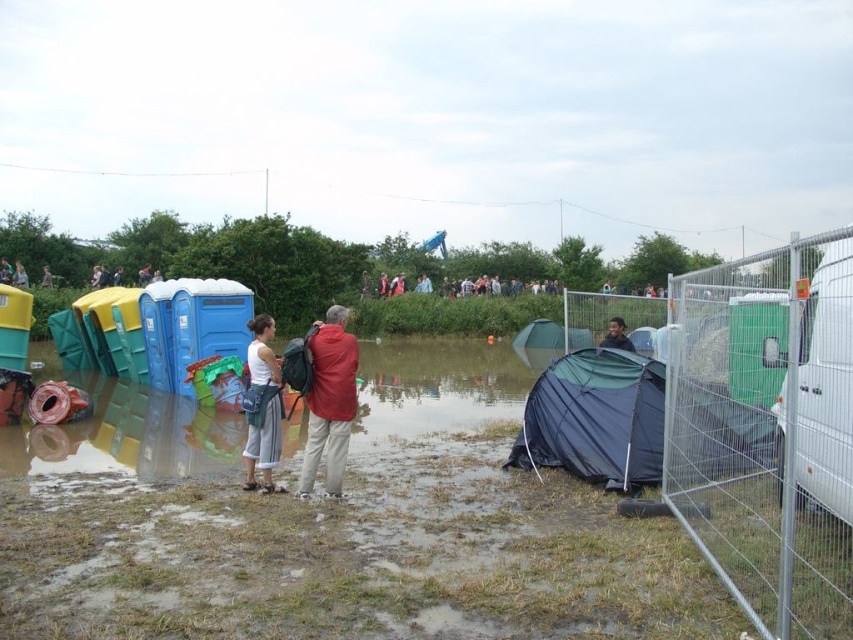
Who is positioned more to the left, dark blue tarp at lower right or dark blue tarp at center?

Positioned to the left is dark blue tarp at lower right.

The height and width of the screenshot is (640, 853). I want to click on dark blue tarp at lower right, so (x=587, y=392).

Find the location of a particular element. The width and height of the screenshot is (853, 640). dark blue tarp at lower right is located at coordinates (587, 392).

Is red matte jacket at center shorter than dark brown hair at center?

No, red matte jacket at center is not shorter than dark brown hair at center.

How far apart are red matte jacket at center and dark brown hair at center?

4.24 meters

This screenshot has width=853, height=640. In order to click on red matte jacket at center in this screenshot , I will do [329, 401].

Who is more forward, (329, 436) or (555, 284)?

Point (329, 436) is more forward.

Which is more to the left, red matte jacket at center or dark gray jacket at center?

Positioned to the left is red matte jacket at center.

Locate an element on the screen. This screenshot has height=640, width=853. red matte jacket at center is located at coordinates (329, 401).